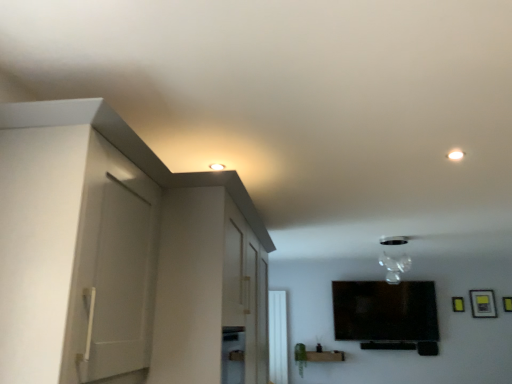
Question: Is there a large distance between white glossy window at center and white matte cabinet at left?

Choices:
 (A) no
 (B) yes

Answer: (B)

Question: Is white glossy window at center at the right side of white matte cabinet at left?

Choices:
 (A) yes
 (B) no

Answer: (A)

Question: Can you confirm if white glossy window at center is taller than white matte cabinet at left?

Choices:
 (A) yes
 (B) no

Answer: (A)

Question: Can white matte cabinet at left be found inside white glossy window at center?

Choices:
 (A) no
 (B) yes

Answer: (A)

Question: Is the position of white glossy window at center more distant than that of white matte cabinet at left?

Choices:
 (A) no
 (B) yes

Answer: (B)

Question: From the image's perspective, relative to white matte cabinet at left, is transparent glass vase at upper center above or below?

Choices:
 (A) below
 (B) above

Answer: (A)

Question: From a real-world perspective, relative to white matte cabinet at left, is transparent glass vase at upper center vertically above or below?

Choices:
 (A) below
 (B) above

Answer: (B)

Question: Based on their positions, is transparent glass vase at upper center located to the left or right of white matte cabinet at left?

Choices:
 (A) left
 (B) right

Answer: (B)

Question: Relative to white matte cabinet at left, is transparent glass vase at upper center in front or behind?

Choices:
 (A) behind
 (B) front

Answer: (A)

Question: Is white matte cabinet at left taller or shorter than yellow matte picture frame at upper right, which appears as the first picture frame when viewed from the left?

Choices:
 (A) tall
 (B) short

Answer: (A)

Question: Does point (120, 340) appear closer or farther from the camera than point (458, 311)?

Choices:
 (A) closer
 (B) farther

Answer: (A)

Question: From a real-world perspective, relative to yellow matte picture frame at upper right, which appears as the first picture frame when viewed from the left, is white matte cabinet at left vertically above or below?

Choices:
 (A) above
 (B) below

Answer: (B)

Question: Considering their positions, is white matte cabinet at left located in front of or behind yellow matte picture frame at upper right, which appears as the first picture frame when viewed from the left?

Choices:
 (A) behind
 (B) front

Answer: (B)

Question: Considering the relative positions of transparent glass vase at upper center and yellow matte picture frame at upper right, which appears as the first picture frame when viewed from the left, in the image provided, is transparent glass vase at upper center to the left or to the right of yellow matte picture frame at upper right, which appears as the first picture frame when viewed from the left,?

Choices:
 (A) left
 (B) right

Answer: (A)

Question: Considering the positions of point (391, 243) and point (463, 309), is point (391, 243) closer or farther from the camera than point (463, 309)?

Choices:
 (A) farther
 (B) closer

Answer: (B)